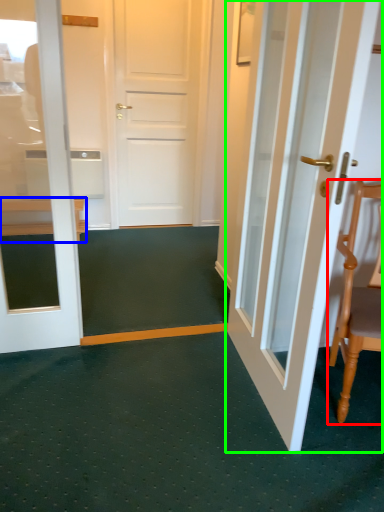
Question: Which object is positioned closest to chair (highlighted by a red box)? Select from furniture (highlighted by a blue box) and door (highlighted by a green box).

Choices:
 (A) furniture
 (B) door

Answer: (B)